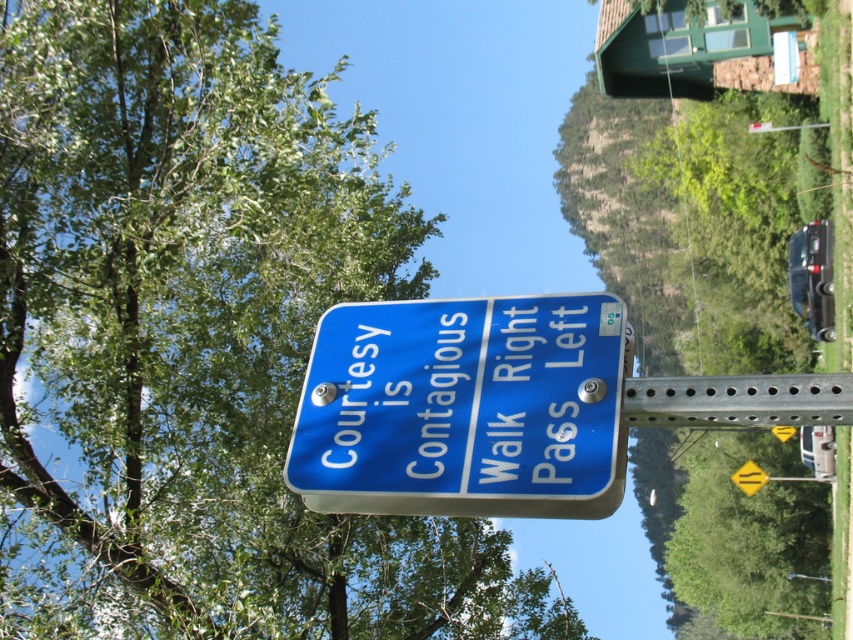
You are a pedestrian standing in front of the blue metallic sign at center. You want to take a photo of the green leafy tree at upper left without any obstruction. Is the tree visible above the sign?

The green leafy tree at upper left is located above the blue metallic sign at center, so it is visible and can be photographed without obstruction.

You are a delivery person carrying a box that is 3 meters long. You need to move it from the green leafy tree at upper left to the blue metallic sign at center. Can you move it without bending or rotating the box?

The distance between the green leafy tree at upper left and the blue metallic sign at center is 4.75 meters. Since the box is 3 meters long, it can be moved without bending or rotating as the distance is sufficient.

You are standing at the point marked as point [200,340] in the image. Looking around, you notice a green leafy tree at upper left. What direction should you face to see the green leafy tree at upper left?

You should face towards the upper left direction to see the green leafy tree at upper left located at point [200,340].